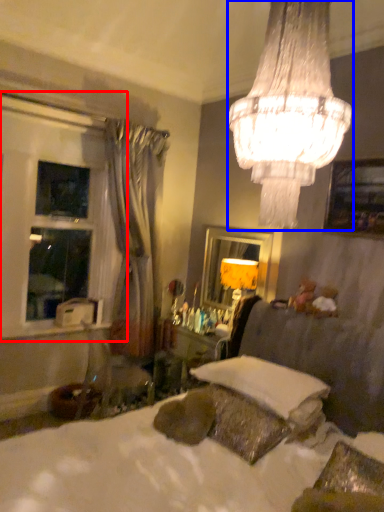
Question: Which of the following is the farthest to the observer, bay window (highlighted by a red box) or lamp (highlighted by a blue box)?

Choices:
 (A) bay window
 (B) lamp

Answer: (A)